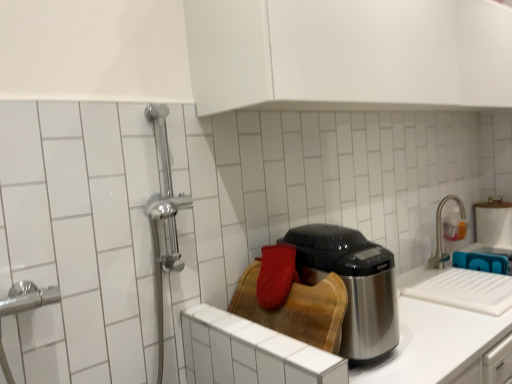
Question: From a real-world perspective, is wooden cutting board at center above or below satin nickel faucet at upper right?

Choices:
 (A) below
 (B) above

Answer: (A)

Question: Based on their positions, is wooden cutting board at center located to the left or right of satin nickel faucet at upper right?

Choices:
 (A) left
 (B) right

Answer: (A)

Question: Which is nearer to the shiny metallic appliance at center?

Choices:
 (A) satin steel counter top at center
 (B) wooden cutting board at center
 (C) satin nickel faucet at upper right

Answer: (A)

Question: Estimate the real-world distances between objects in this image. Which object is farther from the satin steel counter top at center?

Choices:
 (A) wooden cutting board at center
 (B) shiny metallic appliance at center
 (C) satin nickel faucet at upper right

Answer: (C)